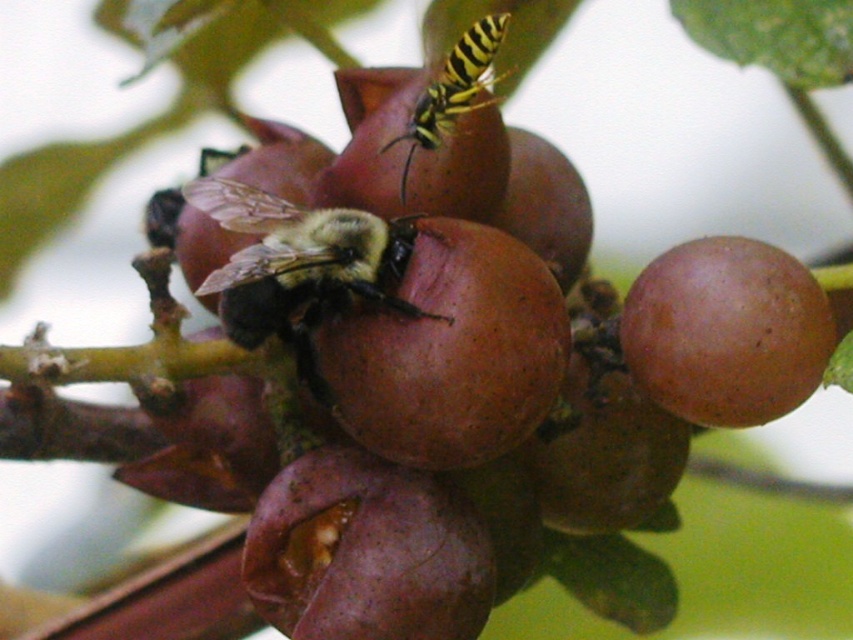
Question: Which of these objects is positioned farthest from the purple matte grape at center?

Choices:
 (A) black fuzzy bee at center
 (B) brown matte fruit at center

Answer: (A)

Question: Which object appears farthest from the camera in this image?

Choices:
 (A) brown matte fruit at center
 (B) black fuzzy bee at center

Answer: (A)

Question: Considering the real-world distances, which object is closest to the black fuzzy bee at center?

Choices:
 (A) yellow-black striped wasp at upper center
 (B) brown matte fruit at center

Answer: (B)

Question: Is the position of brown matte fruit at center less distant than that of purple matte grape at center?

Choices:
 (A) no
 (B) yes

Answer: (B)

Question: Can you confirm if purple matte grape at center is wider than brown matte grape at center?

Choices:
 (A) no
 (B) yes

Answer: (B)

Question: Does purple matte grape at center appear on the left side of black fuzzy bee at center?

Choices:
 (A) no
 (B) yes

Answer: (A)